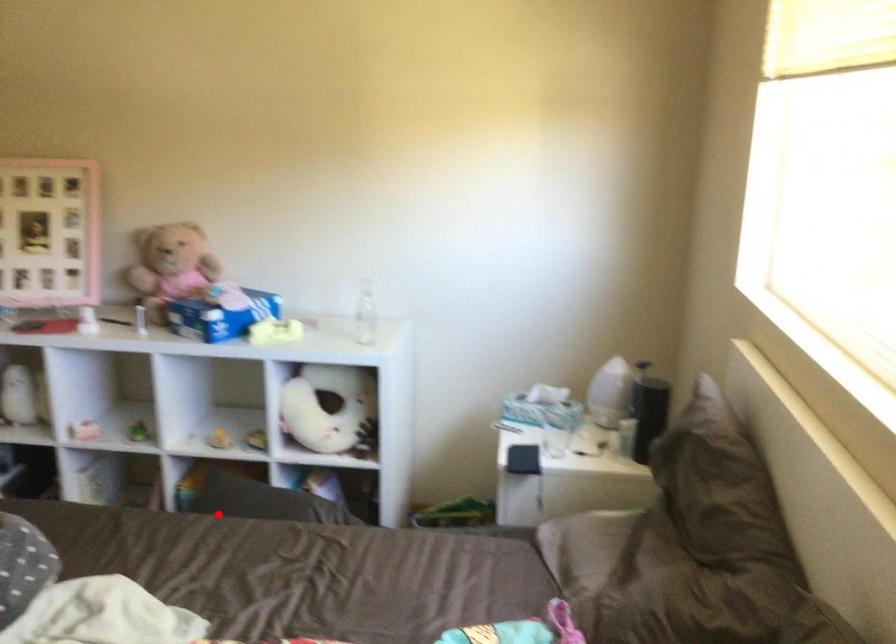
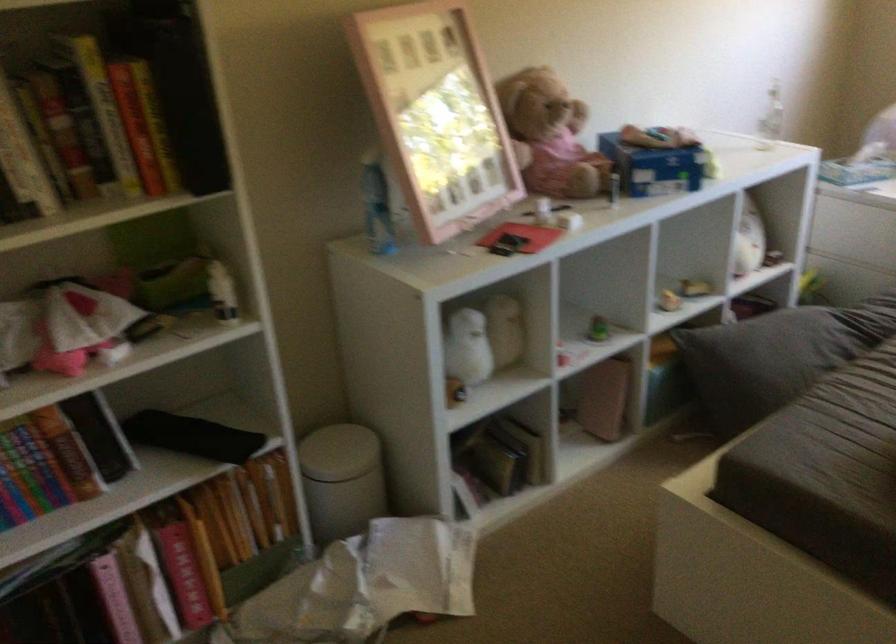
Find the pixel in the second image that matches the highlighted location in the first image.

(776, 357)